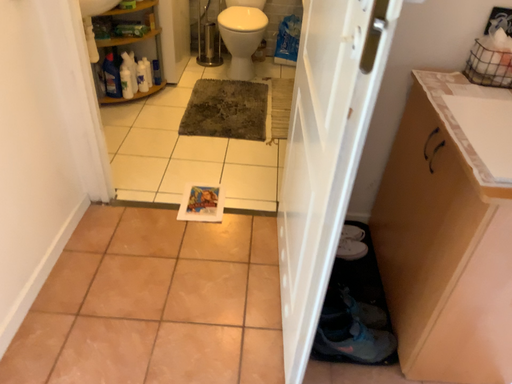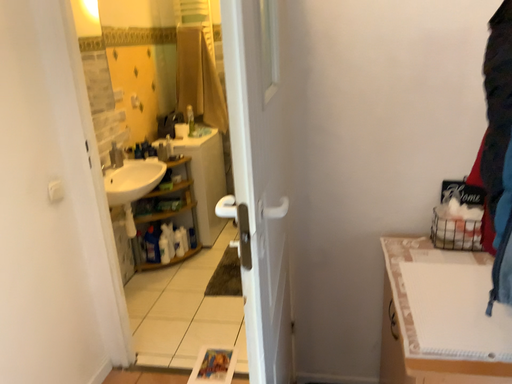
Question: How did the camera likely rotate when shooting the video?

Choices:
 (A) rotated downward
 (B) rotated upward

Answer: (B)